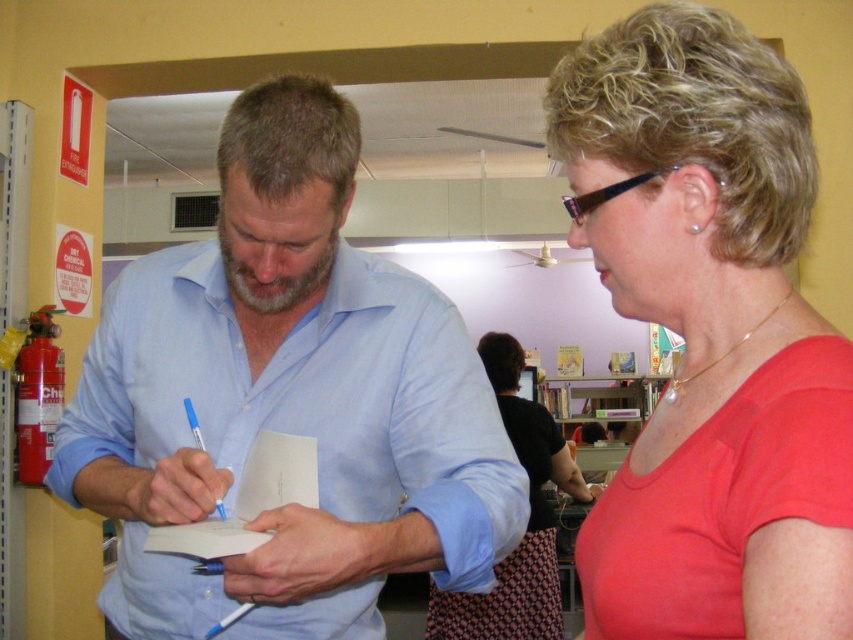
Is point (665, 540) positioned in front of point (561, 636)?

Yes, point (665, 540) is in front of point (561, 636).

Can you confirm if matte red shirt at center is thinner than matte black shirt at center?

Correct, matte red shirt at center's width is less than matte black shirt at center's.

Is point (840, 608) farther from camera compared to point (479, 356)?

No, it is in front of (479, 356).

You are a GUI agent. You are given a task and a screenshot of the screen. Output one action in this format:
    pyautogui.click(x=<x>, y=<y>)
    Task: Click on the matte red shirt at center
    
    Given the screenshot: What is the action you would take?
    pyautogui.click(x=709, y=333)

Is matte black shirt at center closer to camera compared to wooden bookshelf at center?

Yes.

Who is more distant from viewer, (x=547, y=616) or (x=653, y=381)?

The point (x=653, y=381) is behind.

Identify the location of matte black shirt at center. The image size is (853, 640). (527, 522).

Is blue shirt at center to the left of wooden bookshelf at center from the viewer's perspective?

Yes, blue shirt at center is to the left of wooden bookshelf at center.

Identify the location of blue shirt at center. The height and width of the screenshot is (640, 853). (287, 400).

Looking at this image, measure the distance between point (x=434, y=518) and camera.

Point (x=434, y=518) is 37.38 inches from camera.

The height and width of the screenshot is (640, 853). Find the location of `blue shirt at center`. blue shirt at center is located at coordinates (287, 400).